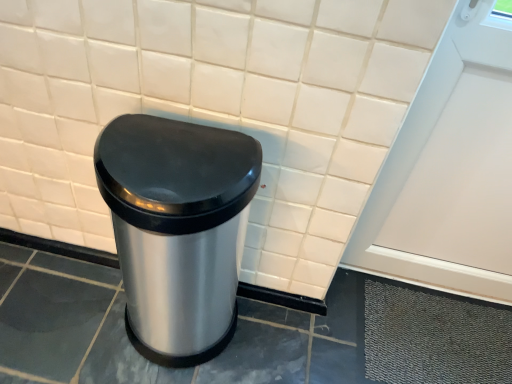
Locate an element on the screen. free point above satin silver trash can at center (from a real-world perspective) is located at coordinates (175, 157).